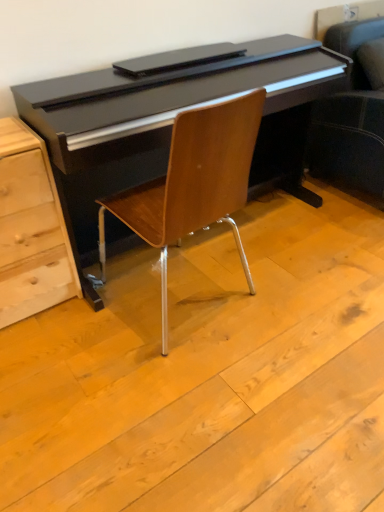
I want to click on space that is in front of woodenchair at center, so click(175, 393).